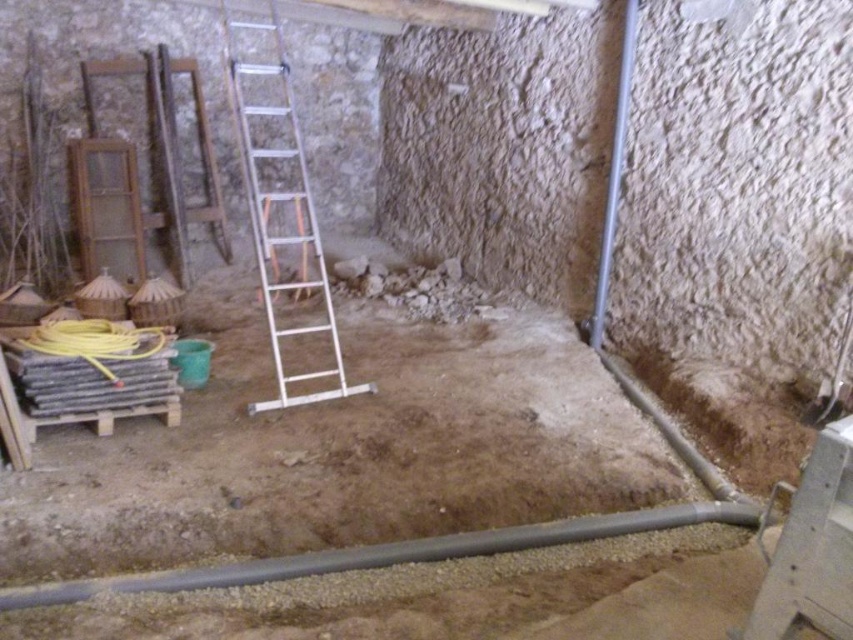
The width and height of the screenshot is (853, 640). What do you see at coordinates (265, 220) in the screenshot? I see `silver metallic ladder at center` at bounding box center [265, 220].

From the picture: Can you confirm if silver metallic ladder at center is smaller than yellow rubber hose at lower left?

Incorrect, silver metallic ladder at center is not smaller in size than yellow rubber hose at lower left.

This screenshot has height=640, width=853. What are the coordinates of `silver metallic ladder at center` in the screenshot? It's located at (265, 220).

The height and width of the screenshot is (640, 853). Find the location of `gray rubber pipe at lower center`. gray rubber pipe at lower center is located at coordinates (387, 554).

Between gray rubber pipe at lower center and metallic pipe at right, which one appears on the right side from the viewer's perspective?

From the viewer's perspective, metallic pipe at right appears more on the right side.

This screenshot has width=853, height=640. Describe the element at coordinates (387, 554) in the screenshot. I see `gray rubber pipe at lower center` at that location.

Where is `gray rubber pipe at lower center`? gray rubber pipe at lower center is located at coordinates (387, 554).

Is brown dirt at center thinner than yellow rubber hose at lower left?

No, brown dirt at center is not thinner than yellow rubber hose at lower left.

Which is behind, point (152, 524) or point (26, 346)?

Positioned behind is point (26, 346).

Who is more distant from viewer, [22,628] or [112,333]?

Positioned behind is point [112,333].

At what (x,y) coordinates should I click in order to perform the action: click on brown dirt at center. Please return your answer as a coordinate pair (x, y). Image resolution: width=853 pixels, height=640 pixels. Looking at the image, I should click on (341, 449).